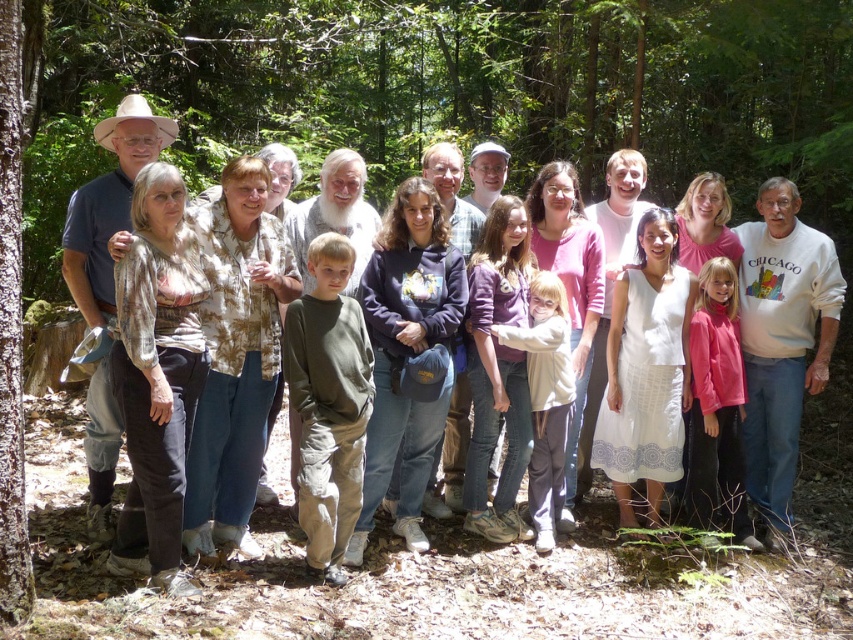
Question: Can you confirm if white cotton sweatshirt at right is positioned to the right of brown rough bark tree at left?

Choices:
 (A) no
 (B) yes

Answer: (B)

Question: Does brown rough bark tree at left have a larger size compared to matte khaki pants at center?

Choices:
 (A) yes
 (B) no

Answer: (A)

Question: Which point is closer to the camera?

Choices:
 (A) (64, 260)
 (B) (163, 128)

Answer: (A)

Question: Which object is positioned farthest from the brown rough bark tree at left?

Choices:
 (A) matte khaki pants at center
 (B) white cotton sweatshirt at right

Answer: (B)

Question: Does brown rough bark tree at left appear on the right side of matte khaki pants at center?

Choices:
 (A) no
 (B) yes

Answer: (B)

Question: Estimate the real-world distances between objects in this image. Which object is farther from the plaid shirt at center?

Choices:
 (A) brown rough bark tree at left
 (B) white cotton sweatshirt at right
 (C) matte khaki pants at center

Answer: (B)